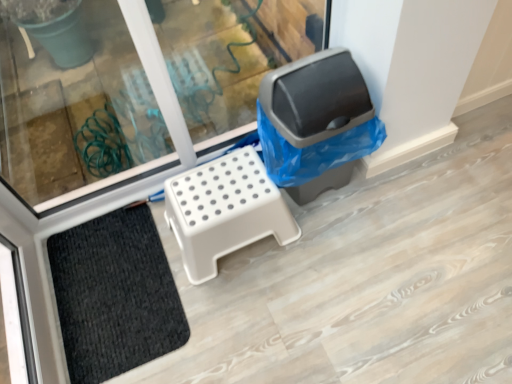
Question: Is black textured mat at lower left to the left of gray plastic recycling bin at right from the viewer's perspective?

Choices:
 (A) yes
 (B) no

Answer: (A)

Question: Is gray plastic recycling bin at right inside black textured mat at lower left?

Choices:
 (A) no
 (B) yes

Answer: (A)

Question: Does black textured mat at lower left have a lesser width compared to gray plastic recycling bin at right?

Choices:
 (A) yes
 (B) no

Answer: (B)

Question: Does black textured mat at lower left come in front of gray plastic recycling bin at right?

Choices:
 (A) yes
 (B) no

Answer: (B)

Question: Is black textured mat at lower left not inside gray plastic recycling bin at right?

Choices:
 (A) yes
 (B) no

Answer: (A)

Question: Is black textured mat at lower left far from gray plastic recycling bin at right?

Choices:
 (A) yes
 (B) no

Answer: (B)

Question: From a real-world perspective, is gray plastic recycling bin at right below black textured mat at lower left?

Choices:
 (A) no
 (B) yes

Answer: (A)

Question: Is gray plastic recycling bin at right further to camera compared to black textured mat at lower left?

Choices:
 (A) no
 (B) yes

Answer: (A)

Question: Can you confirm if gray plastic recycling bin at right is thinner than black textured mat at lower left?

Choices:
 (A) yes
 (B) no

Answer: (A)

Question: Does gray plastic recycling bin at right have a smaller size compared to black textured mat at lower left?

Choices:
 (A) yes
 (B) no

Answer: (B)

Question: From a real-world perspective, is gray plastic recycling bin at right physically above black textured mat at lower left?

Choices:
 (A) no
 (B) yes

Answer: (B)

Question: From the image's perspective, does gray plastic recycling bin at right appear higher than black textured mat at lower left?

Choices:
 (A) yes
 (B) no

Answer: (A)

Question: Does gray plastic recycling bin at right have a lesser width compared to white plastic step stool at center?

Choices:
 (A) no
 (B) yes

Answer: (B)